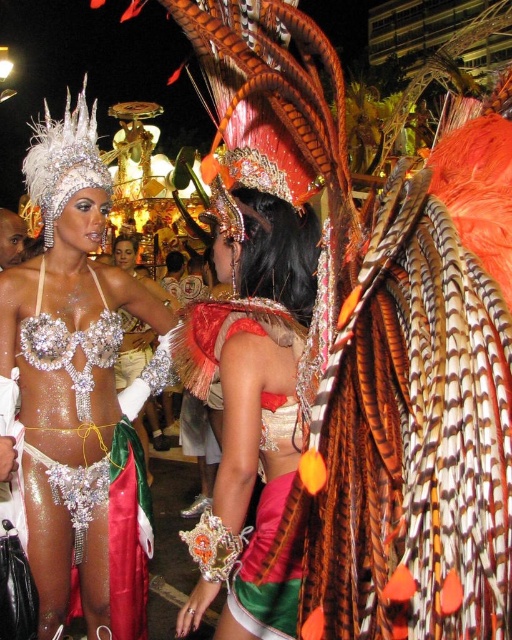
Question: Which point appears farthest from the camera in this image?

Choices:
 (A) (105, 481)
 (B) (249, 349)

Answer: (A)

Question: Which object appears closest to the camera in this image?

Choices:
 (A) shiny metallic bikini top at center
 (B) shiny silver bikini top at center

Answer: (A)

Question: Does shiny silver bikini top at center have a lesser width compared to shiny metallic bikini top at center?

Choices:
 (A) yes
 (B) no

Answer: (B)

Question: From the image, what is the correct spatial relationship of shiny silver bikini top at center in relation to shiny metallic bikini top at center?

Choices:
 (A) above
 (B) below

Answer: (A)

Question: Is shiny silver bikini top at center bigger than shiny metallic bikini top at center?

Choices:
 (A) no
 (B) yes

Answer: (B)